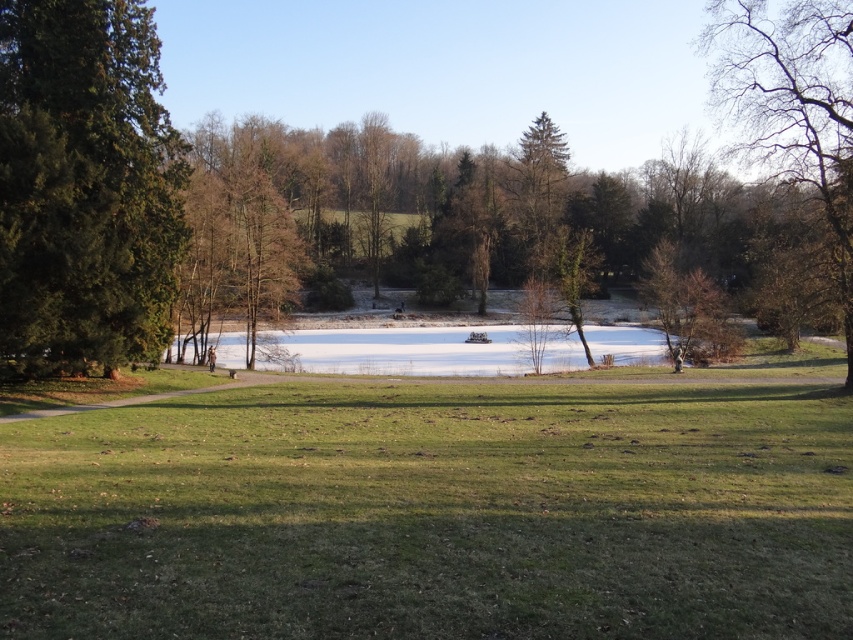
Locate an element on the screen. Image resolution: width=853 pixels, height=640 pixels. green textured tree at left is located at coordinates (85, 188).

Is green textured tree at left shorter than bare wood tree at right?

In fact, green textured tree at left may be taller than bare wood tree at right.

This screenshot has height=640, width=853. I want to click on green textured tree at left, so click(85, 188).

Find the location of a particular element. green textured tree at left is located at coordinates (85, 188).

Between green grassy at center and bare branches at upper right, which one appears on the right side from the viewer's perspective?

bare branches at upper right is more to the right.

Can you confirm if green grassy at center is positioned below bare branches at upper right?

Yes, green grassy at center is below bare branches at upper right.

Who is more forward, (799, 618) or (782, 164)?

Point (799, 618) is more forward.

Locate an element on the screen. This screenshot has height=640, width=853. green grassy at center is located at coordinates (433, 513).

Is green textured tree at left thinner than bare branches at upper right?

Correct, green textured tree at left's width is less than bare branches at upper right's.

Consider the image. Does green textured tree at left appear over bare branches at upper right?

Actually, green textured tree at left is below bare branches at upper right.

Does point (32, 26) come behind point (840, 33)?

No, it is not.

This screenshot has width=853, height=640. In order to click on green textured tree at left in this screenshot , I will do `click(85, 188)`.